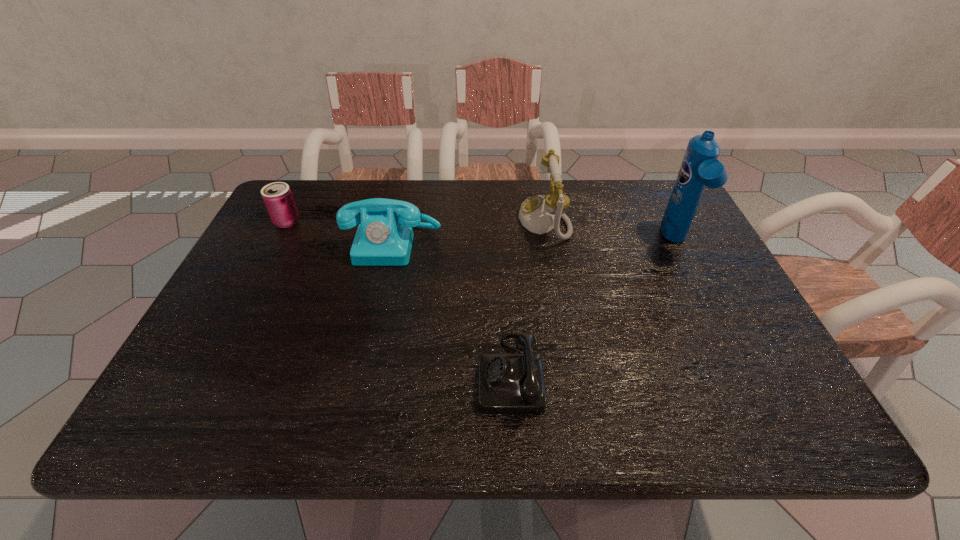
Locate an element on the screen. This screenshot has height=540, width=960. object located in the left edge section of the desktop is located at coordinates (277, 196).

Where is `object at the right edge`? object at the right edge is located at coordinates (700, 168).

You are a GUI agent. You are given a task and a screenshot of the screen. Output one action in this format:
    pyautogui.click(x=<x>, y=<y>)
    Task: Click on the object at the far left corner
    
    Given the screenshot: What is the action you would take?
    pyautogui.click(x=277, y=196)

Identify the location of object located at the far right corner. (700, 168).

In the image, there is a desktop. Where is `vacant space at the far edge`? vacant space at the far edge is located at coordinates (473, 198).

This screenshot has height=540, width=960. Find the location of `vacant space at the near edge of the desktop`. vacant space at the near edge of the desktop is located at coordinates (345, 407).

Where is `free space at the left edge of the desktop`? The height and width of the screenshot is (540, 960). free space at the left edge of the desktop is located at coordinates (290, 243).

Locate an element on the screen. free region at the right edge of the desktop is located at coordinates (652, 253).

You are a GUI agent. You are given a task and a screenshot of the screen. Output one action in this format:
    pyautogui.click(x=<x>, y=<y>)
    Task: Click on the free space at the near left corner of the desktop
    The height and width of the screenshot is (540, 960).
    Given the screenshot: What is the action you would take?
    pyautogui.click(x=200, y=398)

Find the location of a particular element. This screenshot has width=960, height=540. vacant space at the far right corner is located at coordinates (638, 186).